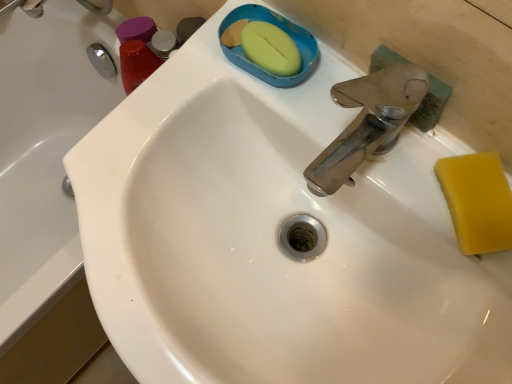
Where is `white glossy sink at center`? The image size is (512, 384). white glossy sink at center is located at coordinates (54, 171).

Describe the element at coordinates (54, 171) in the screenshot. This screenshot has height=384, width=512. I see `white glossy sink at center` at that location.

In order to face yellow sponge at right, should I rotate leftwards or rightwards?

To align with it, rotate right about 28.219°.

This screenshot has width=512, height=384. What do you see at coordinates (477, 201) in the screenshot?
I see `yellow sponge at right` at bounding box center [477, 201].

The height and width of the screenshot is (384, 512). I want to click on yellow sponge at right, so click(x=477, y=201).

Where is `white glossy sink at center`? white glossy sink at center is located at coordinates click(x=54, y=171).

Can you confirm if yellow sponge at right is positioned to the right of white glossy sink at center?

Yes, yellow sponge at right is to the right of white glossy sink at center.

Which is in front, yellow sponge at right or white glossy sink at center?

yellow sponge at right is more forward.

Which point is more forward, (510, 200) or (61, 74)?

The point (510, 200) is closer to the camera.

From the image's perspective, which is above, yellow sponge at right or white glossy sink at center?

yellow sponge at right is shown above in the image.

From a real-world perspective, is yellow sponge at right over white glossy sink at center?

Yes, from a real-world perspective, yellow sponge at right is over white glossy sink at center

Does yellow sponge at right have a lesser width compared to white glossy sink at center?

Correct, the width of yellow sponge at right is less than that of white glossy sink at center.

Who is taller, yellow sponge at right or white glossy sink at center?

white glossy sink at center is taller.

Does yellow sponge at right have a smaller size compared to white glossy sink at center?

Yes, yellow sponge at right is smaller than white glossy sink at center.

Do you think yellow sponge at right is within white glossy sink at center, or outside of it?

yellow sponge at right is located beyond the bounds of white glossy sink at center.

Is yellow sponge at right not near white glossy sink at center?

They are positioned close to each other.

Is yellow sponge at right looking in the opposite direction of white glossy sink at center?

yellow sponge at right is not turned away from white glossy sink at center.

Where is `soap above the white glossy sink at center (from a real-world perspective)`? The height and width of the screenshot is (384, 512). soap above the white glossy sink at center (from a real-world perspective) is located at coordinates (477, 201).

Consider the image. Considering the relative positions of white glossy sink at center and yellow sponge at right in the image provided, is white glossy sink at center to the right of yellow sponge at right from the viewer's perspective?

No, white glossy sink at center is not to the right of yellow sponge at right.

In the scene shown: Which object is further away from the camera, white glossy sink at center or yellow sponge at right?

white glossy sink at center is more distant.

Which is closer, (x=50, y=83) or (x=465, y=170)?

Point (x=50, y=83).

From the image's perspective, who appears lower, white glossy sink at center or yellow sponge at right?

From the image's view, white glossy sink at center is below.

From a real-world perspective, relative to yellow sponge at right, is white glossy sink at center vertically above or below?

From a real-world perspective, white glossy sink at center is physically below yellow sponge at right.

Can you confirm if white glossy sink at center is thinner than yellow sponge at right?

In fact, white glossy sink at center might be wider than yellow sponge at right.

Between white glossy sink at center and yellow sponge at right, which one has more height?

white glossy sink at center is taller.

Considering the sizes of objects white glossy sink at center and yellow sponge at right in the image provided, who is smaller, white glossy sink at center or yellow sponge at right?

yellow sponge at right is smaller.

Is white glossy sink at center inside or outside of yellow sponge at right?

white glossy sink at center is located beyond the bounds of yellow sponge at right.

Is white glossy sink at center directly adjacent to yellow sponge at right?

No, white glossy sink at center is not in contact with yellow sponge at right.

Is yellow sponge at right at the back of white glossy sink at center?

No, white glossy sink at center is not facing the opposite direction of yellow sponge at right.

How different are the orientations of white glossy sink at center and yellow sponge at right in degrees?

white glossy sink at center and yellow sponge at right are facing 130 degrees away from each other.

This screenshot has height=384, width=512. In order to click on bath located underneath the yellow sponge at right (from a real-world perspective) in this screenshot , I will do `click(54, 171)`.

Where is `bath that is behind the yellow sponge at right`? This screenshot has height=384, width=512. bath that is behind the yellow sponge at right is located at coordinates (54, 171).

Find the location of `bath that is below the yellow sponge at right (from the image's perspective)`. bath that is below the yellow sponge at right (from the image's perspective) is located at coordinates (54, 171).